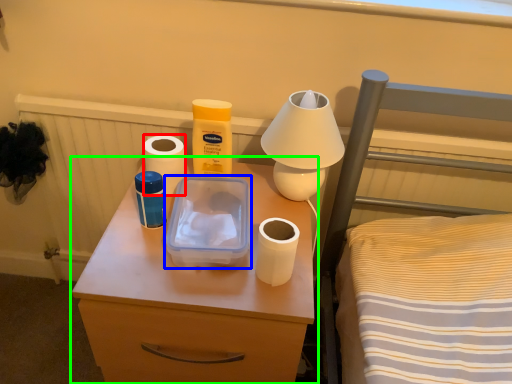
Question: Estimate the real-world distances between objects in this image. Which object is closer to toilet paper (highlighted by a red box), lunch box (highlighted by a blue box) or nightstand (highlighted by a green box)?

Choices:
 (A) lunch box
 (B) nightstand

Answer: (A)